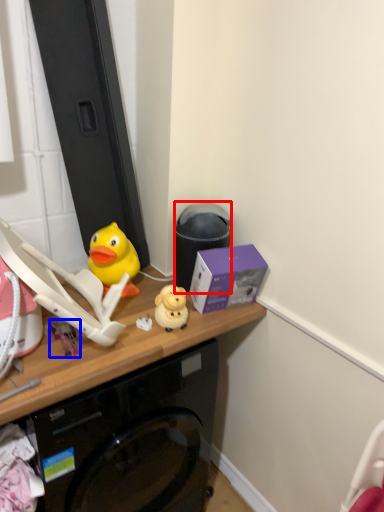
Question: Which object is further to the camera taking this photo, trash bin/can (highlighted by a red box) or toy (highlighted by a blue box)?

Choices:
 (A) trash bin/can
 (B) toy

Answer: (A)